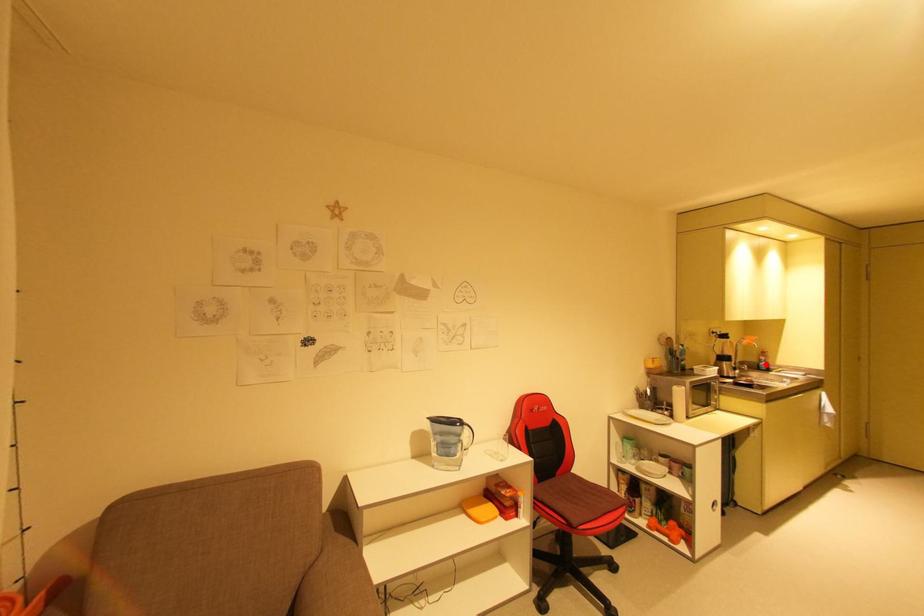
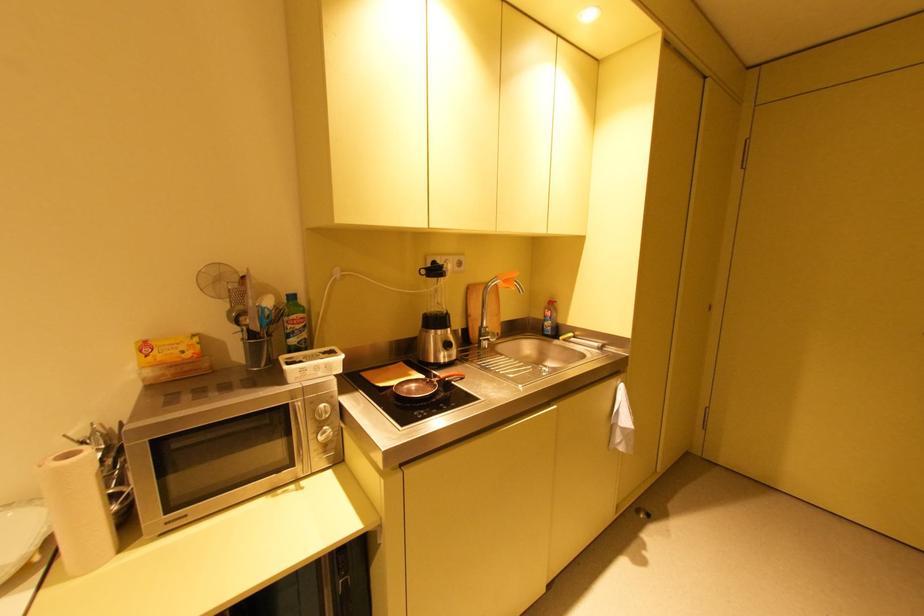
Find the pixel in the second image that matches the highlighted location in the first image.

(551, 323)